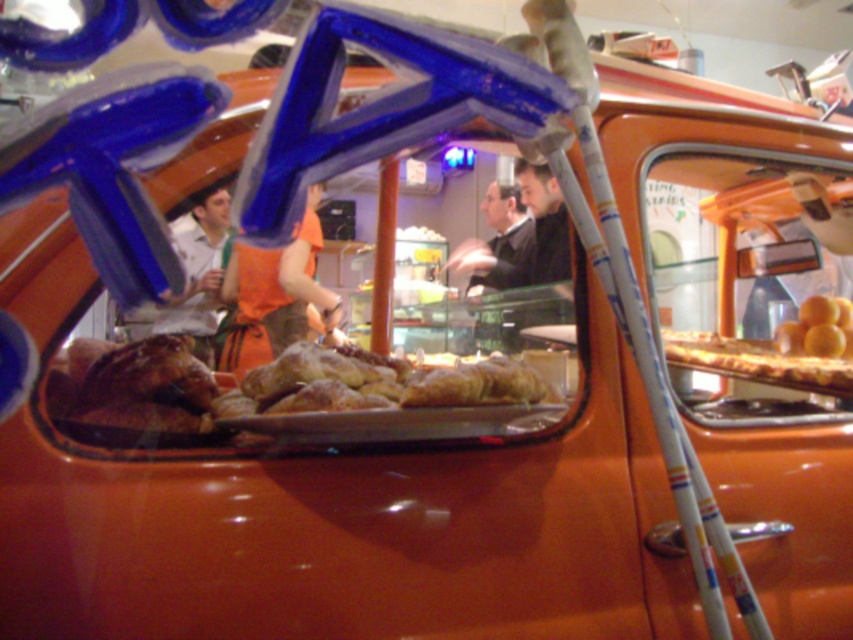
Question: Observing the image, what is the correct spatial positioning of dark suit at center in reference to yellow matte oranges at right?

Choices:
 (A) left
 (B) right

Answer: (A)

Question: Among these points, which one is farthest from the camera?

Choices:
 (A) (485, 280)
 (B) (798, 337)
 (C) (341, 396)

Answer: (A)

Question: Based on their relative distances, which object is farther from the yellow matte oranges at right?

Choices:
 (A) golden brown pastry at center
 (B) dark suit at center

Answer: (B)

Question: Can you confirm if golden brown pastry at center is smaller than yellow matte oranges at right?

Choices:
 (A) yes
 (B) no

Answer: (B)

Question: Observing the image, what is the correct spatial positioning of dark suit at center in reference to yellow matte oranges at right?

Choices:
 (A) above
 (B) below

Answer: (A)

Question: Considering the real-world distances, which object is closest to the golden brown pastry at center?

Choices:
 (A) dark suit at center
 (B) yellow matte oranges at right

Answer: (B)